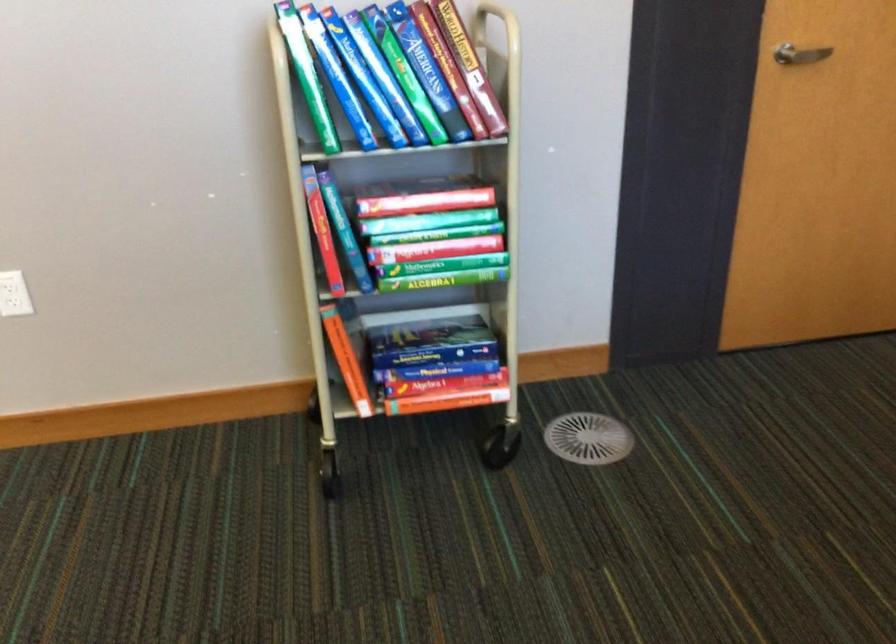
At what (x,y) coordinates should I click in order to perform the action: click on blue spine book. Please return your answer as a coordinate pair (x, y). Looking at the image, I should click on (337, 77).